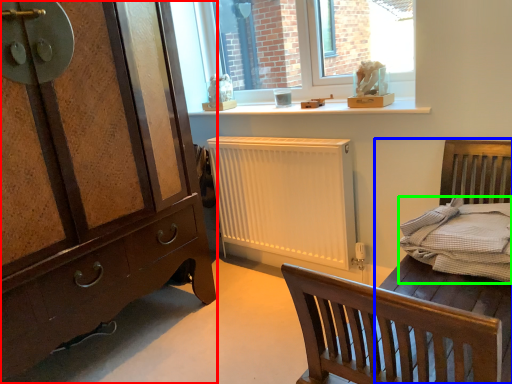
Question: Which object is positioned closest to chest of drawers (highlighted by a red box)? Select from bed frame (highlighted by a blue box) and bedding (highlighted by a green box).

Choices:
 (A) bed frame
 (B) bedding

Answer: (A)